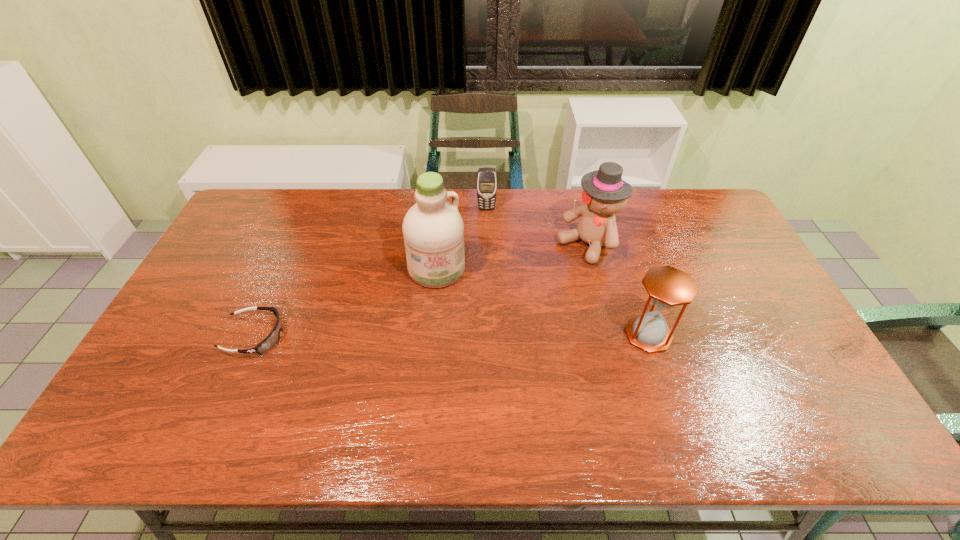
I want to click on vacant point located between the rag_doll and the tallest object, so click(513, 257).

At what (x,y) coordinates should I click in order to perform the action: click on free spot between the third shortest object and the third object from left to right. Please return your answer as a coordinate pair (x, y). Looking at the image, I should click on (567, 272).

Locate an element on the screen. The height and width of the screenshot is (540, 960). empty space between the third tallest object and the farthest object is located at coordinates (567, 272).

This screenshot has width=960, height=540. Find the location of `free space that is in between the third shortest object and the goggles`. free space that is in between the third shortest object and the goggles is located at coordinates (452, 335).

Locate an element on the screen. empty location between the fourth object from right to left and the third shortest object is located at coordinates (542, 302).

The height and width of the screenshot is (540, 960). I want to click on object that is the fourth closest to the hourglass, so click(271, 340).

At what (x,y) coordinates should I click in order to perform the action: click on object that is the closest to the shortest object. Please return your answer as a coordinate pair (x, y). Looking at the image, I should click on (433, 229).